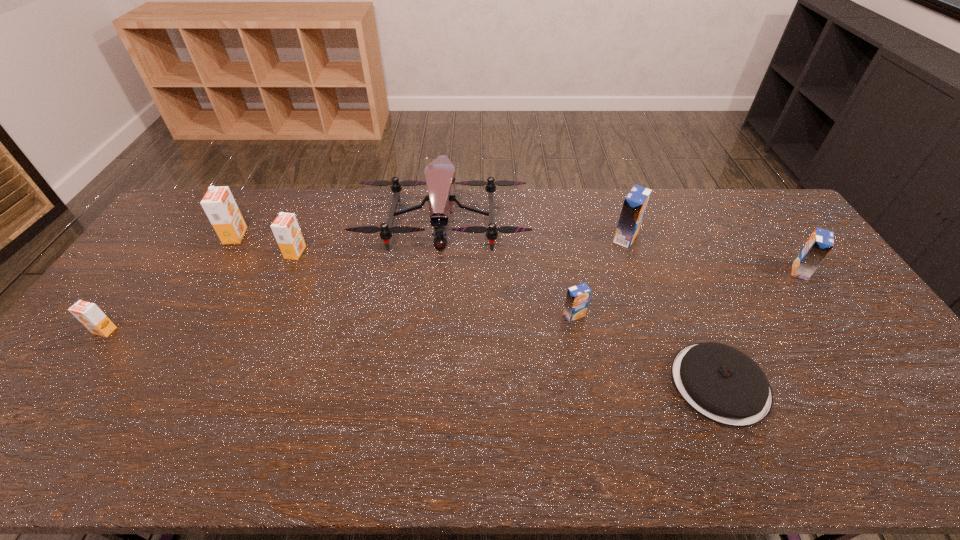
The width and height of the screenshot is (960, 540). Identify the location of drone. (x=439, y=174).

Where is `gray drone`? The image size is (960, 540). gray drone is located at coordinates (439, 174).

Identify the location of the farthest blue orange_juice. The height and width of the screenshot is (540, 960). (635, 203).

At what (x,y) coordinates should I click in order to perform the action: click on the second orange juice from right to left. Please return your answer as a coordinate pair (x, y). Looking at the image, I should click on (635, 203).

This screenshot has width=960, height=540. In order to click on the second orange orange juice from left to right in this screenshot , I will do `click(218, 203)`.

The height and width of the screenshot is (540, 960). In order to click on the second object from left to right in this screenshot , I will do `click(218, 203)`.

Where is `the third nearest orange juice`? Image resolution: width=960 pixels, height=540 pixels. the third nearest orange juice is located at coordinates (820, 243).

The height and width of the screenshot is (540, 960). In order to click on the second smallest blue orange_juice in this screenshot , I will do `click(820, 243)`.

I want to click on the second biggest orange orange juice, so click(x=286, y=230).

Where is `the third object from left to right`? the third object from left to right is located at coordinates (286, 230).